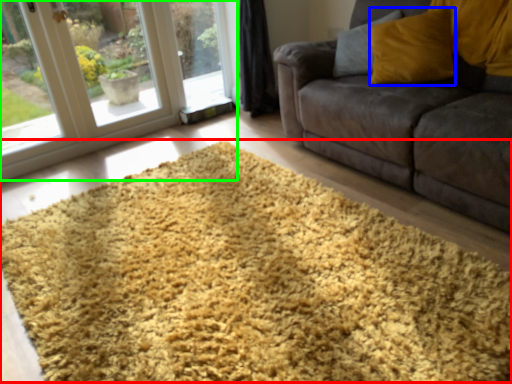
Question: Considering the real-world distances, which object is closest to hay (highlighted by a red box)? throw pillow (highlighted by a blue box) or window (highlighted by a green box).

Choices:
 (A) throw pillow
 (B) window

Answer: (A)